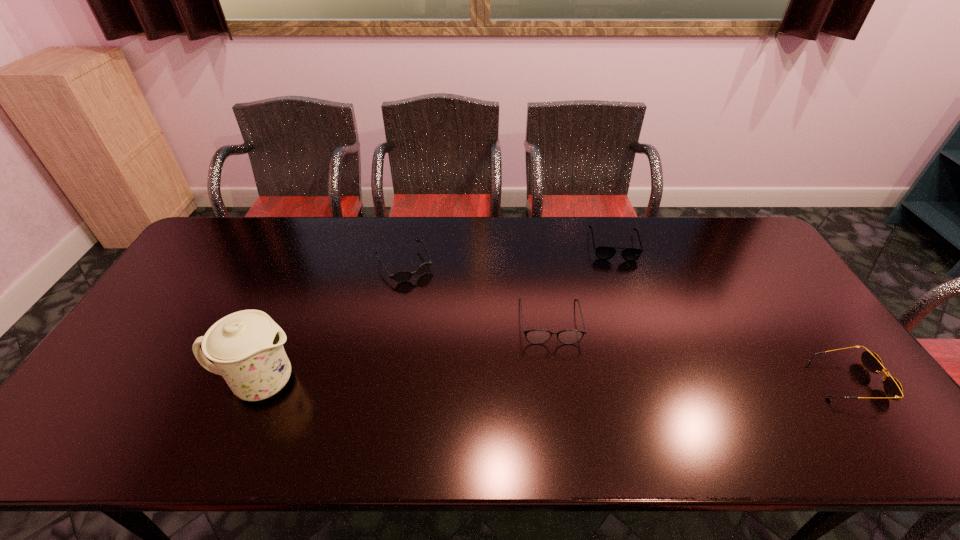
Image resolution: width=960 pixels, height=540 pixels. Identify the location of the leftmost object. (246, 347).

Locate an element on the screen. the tallest object is located at coordinates (246, 347).

The height and width of the screenshot is (540, 960). What are the coordinates of `the rightmost object` in the screenshot? It's located at (893, 389).

Where is `the right sunglasses`? the right sunglasses is located at coordinates (893, 389).

You are a GUI agent. You are given a task and a screenshot of the screen. Output one action in this format:
    pyautogui.click(x=<x>, y=<y>)
    Task: Click on the second object from right to left
    
    Given the screenshot: What is the action you would take?
    pyautogui.click(x=604, y=253)

Locate an element on the screen. Image resolution: width=960 pixels, height=540 pixels. the farther spectacles is located at coordinates (604, 253).

I want to click on the fourth object from right to left, so pos(402,276).

You are a GUI agent. You are given a task and a screenshot of the screen. Output one action in this format:
    pyautogui.click(x=<x>, y=<y>)
    Task: Click on the left sunglasses
    
    Given the screenshot: What is the action you would take?
    pyautogui.click(x=402, y=276)

This screenshot has width=960, height=540. Find the location of `the nearer spectacles`. the nearer spectacles is located at coordinates (537, 336).

This screenshot has height=540, width=960. In order to click on the third object from left to right in this screenshot , I will do `click(537, 336)`.